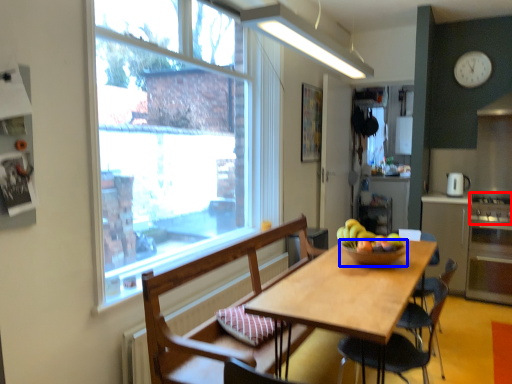
Question: Among these objects, which one is nearest to the camera, stove (highlighted by a red box) or bowl (highlighted by a blue box)?

Choices:
 (A) stove
 (B) bowl

Answer: (B)